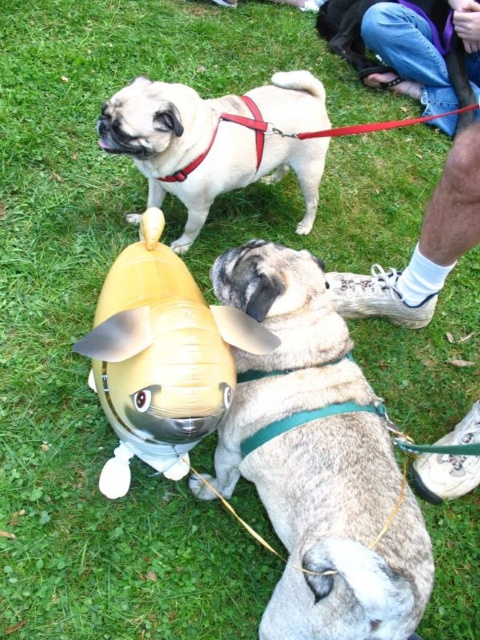
You are a photographer trying to capture a photo of the fuzzy beige dog at lower center. The camera is positioned at point 0.0, 0.0. What direction should you move the camera to get the dog in the center of the frame?

The fuzzy beige dog at lower center is located at point (x=317, y=460). To center it, move the camera upward and to the right since the dog is above and to the right of the current position.

You are standing at the origin point of the coordinate system. You see a point at coordinates point (317,460). Which object is this point located on?

The point (317,460) is located on the fuzzy beige dog at lower center.